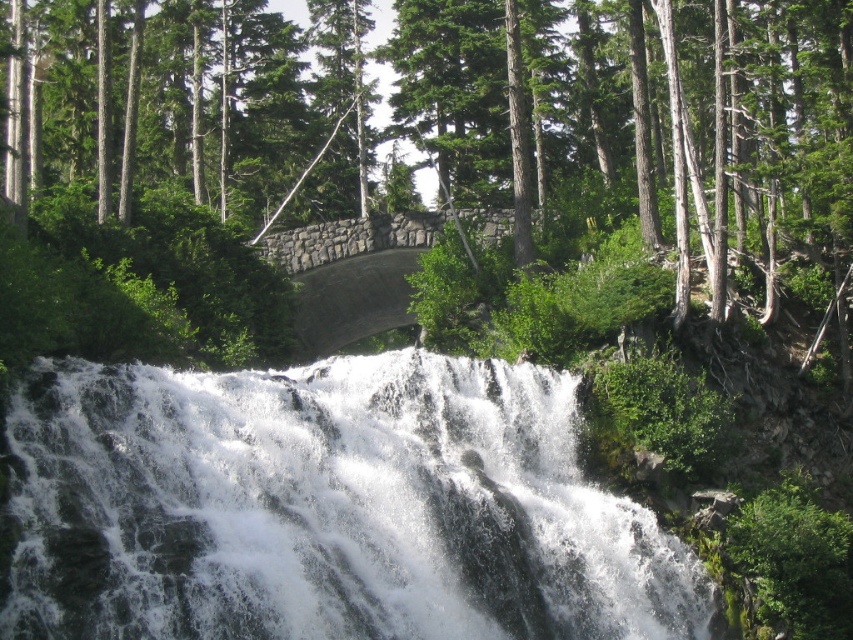
Between point (238, 36) and point (267, 394), which one is positioned in front?

Positioned in front is point (267, 394).

Where is `green leafy tree at center`? The image size is (853, 640). green leafy tree at center is located at coordinates (440, 140).

Where is `green leafy tree at center`? green leafy tree at center is located at coordinates (440, 140).